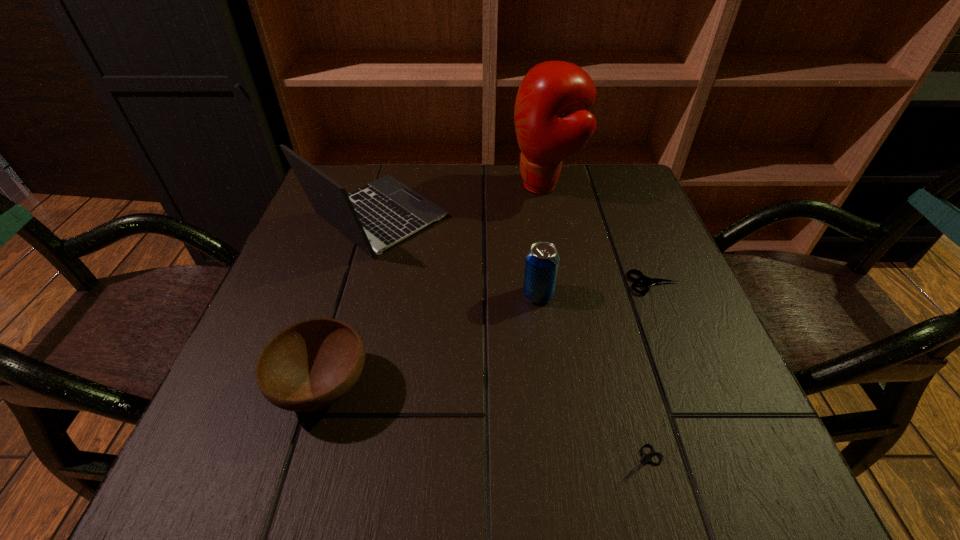
You are a GUI agent. You are given a task and a screenshot of the screen. Output one action in this format:
    pyautogui.click(x=<x>, y=<y>)
    Task: Click on the shears that is at the near edge
    Image resolution: width=960 pixels, height=540 pixels.
    Given the screenshot: What is the action you would take?
    pyautogui.click(x=646, y=458)

The height and width of the screenshot is (540, 960). What are the coordinates of `laptop_computer located in the left edge section of the desktop` in the screenshot? It's located at (385, 211).

Identify the location of bowl present at the left edge. The height and width of the screenshot is (540, 960). (311, 364).

Locate an element on the screen. boxing glove that is at the right edge is located at coordinates (552, 120).

This screenshot has width=960, height=540. In order to click on object positioned at the far left corner in this screenshot , I will do `click(385, 211)`.

Image resolution: width=960 pixels, height=540 pixels. What are the coordinates of `object at the near left corner` in the screenshot? It's located at (311, 364).

Find the location of a particular element. The width and height of the screenshot is (960, 540). object situated at the far right corner is located at coordinates (552, 120).

Find the location of `object that is at the near right corner`. object that is at the near right corner is located at coordinates (646, 458).

At what (x,y) coordinates should I click in order to perform the action: click on vacant space at the far edge of the desktop. Please return your answer as a coordinate pair (x, y). Looking at the image, I should click on (473, 200).

Where is `vacant area at the near edge`? The width and height of the screenshot is (960, 540). vacant area at the near edge is located at coordinates (418, 486).